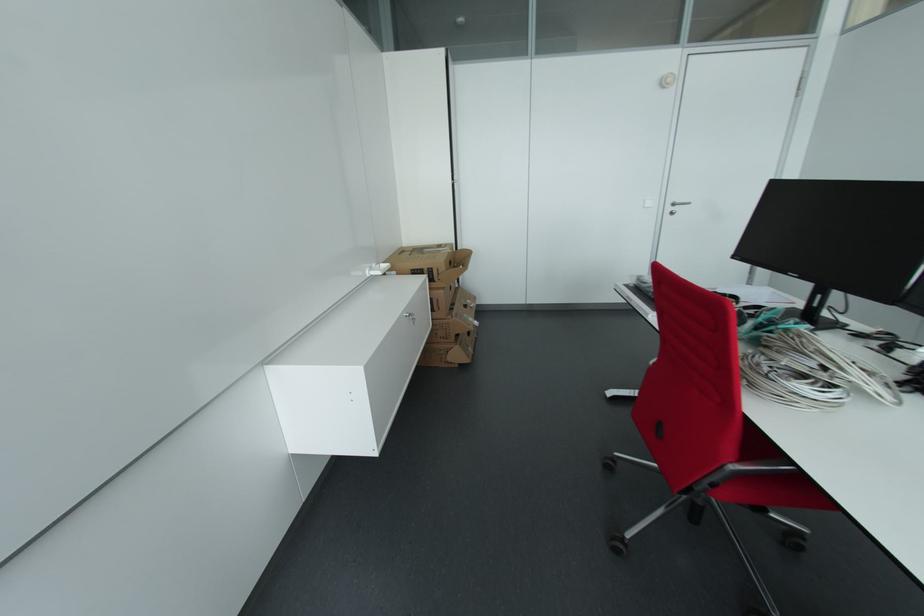
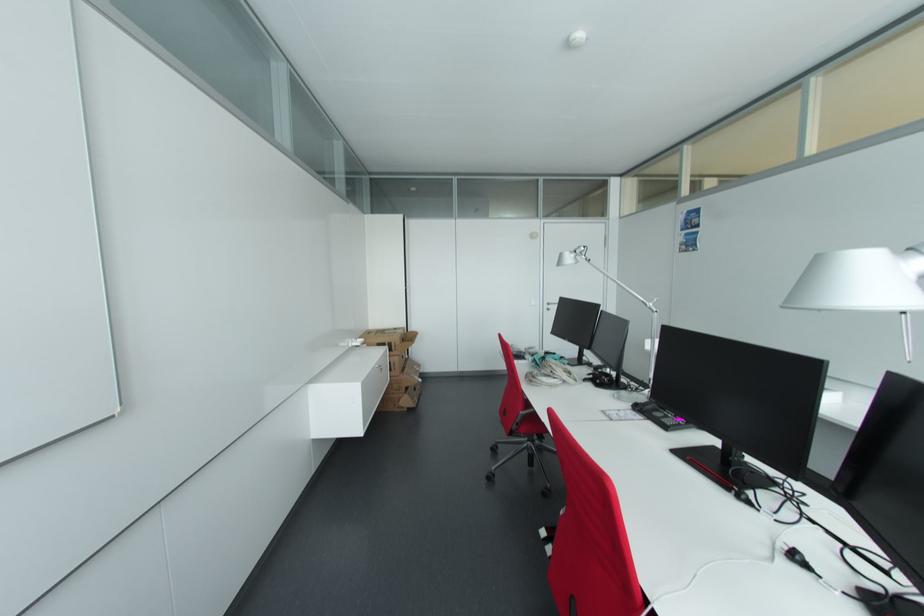
Question: Which direction would the cameraman need to move to produce the second image? Reply with the corresponding letter.

Choices:
 (A) Left
 (B) Right
 (C) Forward
 (D) Backward

Answer: (D)